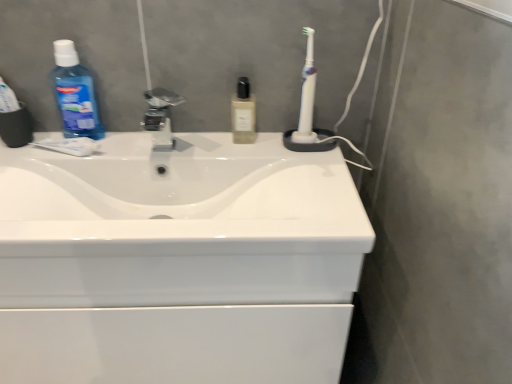
You are a GUI agent. You are given a task and a screenshot of the screen. Output one action in this format:
    pyautogui.click(x=<x>, y=<y>)
    Task: Click on the empty space that is in between satin nickel faucet at center and blue translucent mouthwash at left
    The height and width of the screenshot is (384, 512).
    Given the screenshot: What is the action you would take?
    pyautogui.click(x=131, y=136)